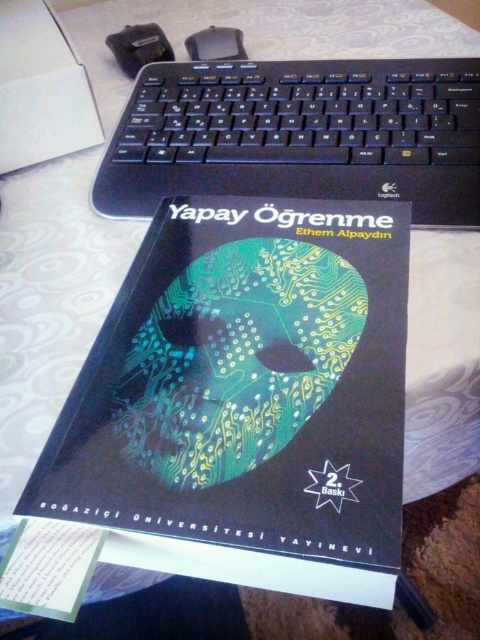
You are organizing your desk and want to place a new item between the green circuit board at center and the black plastic keyboard at upper center. The item you want to place is 8 inches long. Will there be enough space between them to fit it?

The distance between the green circuit board at center and the black plastic keyboard at upper center is 7.29 inches. Since the item you want to place is 8 inches long, which is longer than the available space, it will not fit between them.

You are organizing your desk and need to place a new item between the green circuit board at center and the black plastic keyboard at upper center. Which side should you place it on to ensure it is between them?

The green circuit board at center is to the left of the black plastic keyboard at upper center, so placing the new item between them would require placing it to the right of the green circuit board at center and to the left of the black plastic keyboard at upper center.

In the scene shown: You are organizing your desk and need to place a new item between the green circuit board at center and the black plastic keyboard at upper center. Given their sizes, which object should you place the new item closer to?

The green circuit board at center is much taller than the black plastic keyboard at upper center, so you should place the new item closer to the black plastic keyboard at upper center to maintain balance.